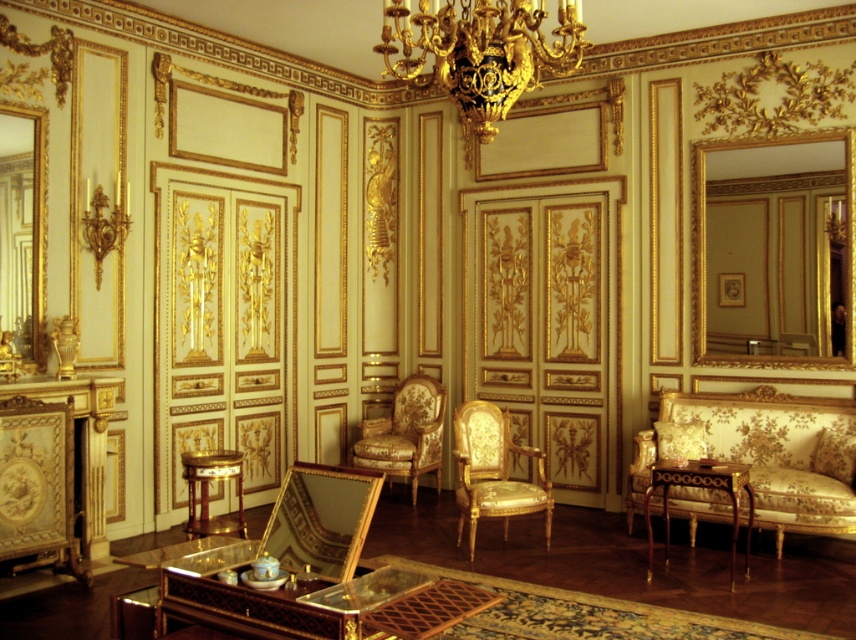
Question: Can you confirm if gold/carved wood armchair at center is positioned below gold floral-patterned armchair at center?

Choices:
 (A) yes
 (B) no

Answer: (A)

Question: Which of these objects is positioned closest to the gold floral-patterned armchair at center?

Choices:
 (A) gold-patterned fabric sofa at right
 (B) gold/carved wood armchair at center
 (C) mahogany wood side table at lower right
 (D) gold ornate chandelier at upper center

Answer: (B)

Question: Which object is positioned closest to the gold/carved wood armchair at center?

Choices:
 (A) gold ornate chandelier at upper center
 (B) mahogany wood side table at lower right

Answer: (B)

Question: Is gold/carved wood armchair at center behind mahogany wood side table at lower right?

Choices:
 (A) yes
 (B) no

Answer: (A)

Question: Does gold ornate chandelier at upper center appear under gold/carved wood armchair at center?

Choices:
 (A) no
 (B) yes

Answer: (A)

Question: Which point is farther from the camera taking this photo?

Choices:
 (A) (544, 500)
 (B) (730, 468)
 (C) (631, 500)

Answer: (C)